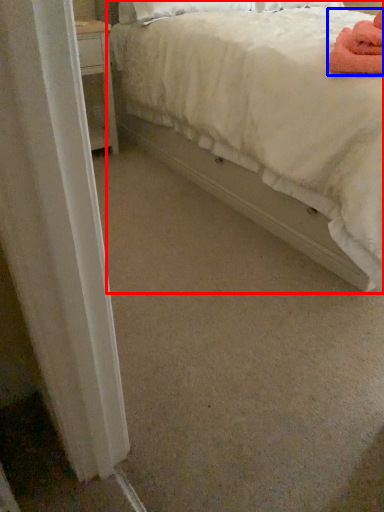
Question: Which object appears farthest to the camera in this image, bed (highlighted by a red box) or bath towel (highlighted by a blue box)?

Choices:
 (A) bed
 (B) bath towel

Answer: (B)